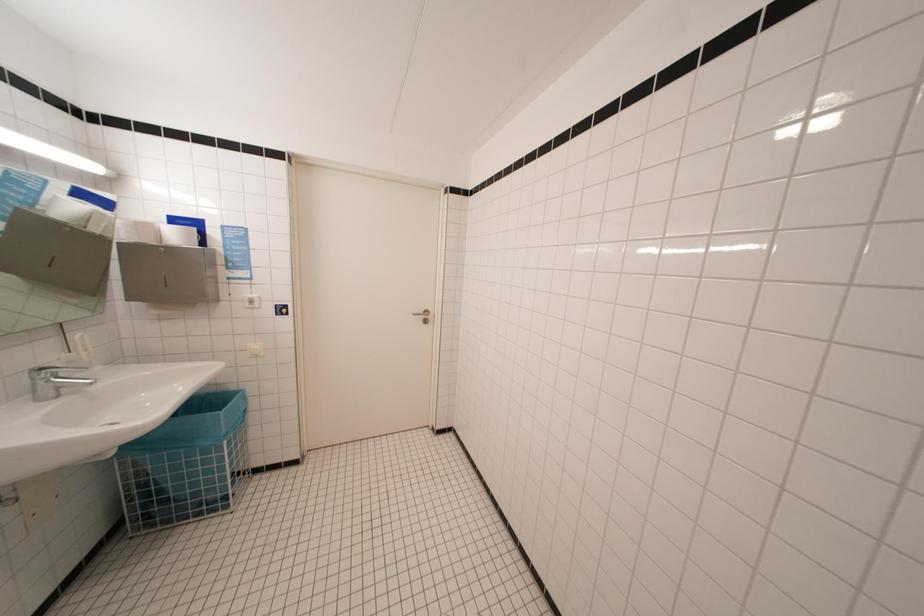
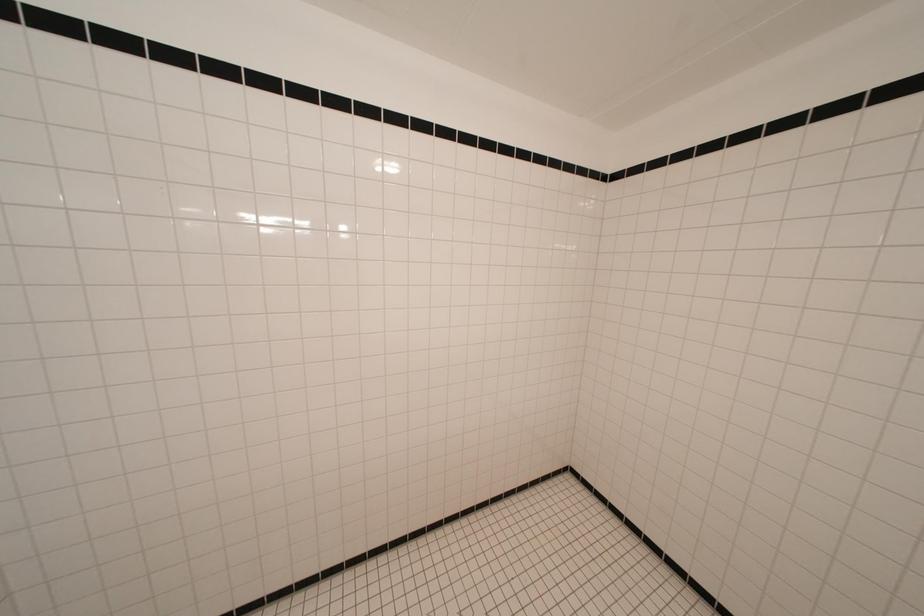
Question: The first image is from the beginning of the video and the second image is from the end. How did the camera likely rotate when shooting the video?

Choices:
 (A) Left
 (B) Right
 (C) Up
 (D) Down

Answer: (B)